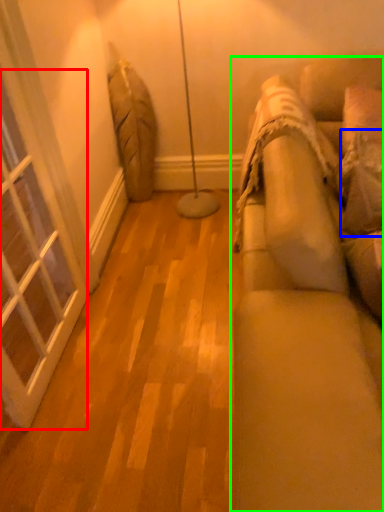
Question: Which object is positioned closest to window (highlighted by a red box)? Select from pillow (highlighted by a blue box) and studio couch (highlighted by a green box).

Choices:
 (A) pillow
 (B) studio couch

Answer: (B)